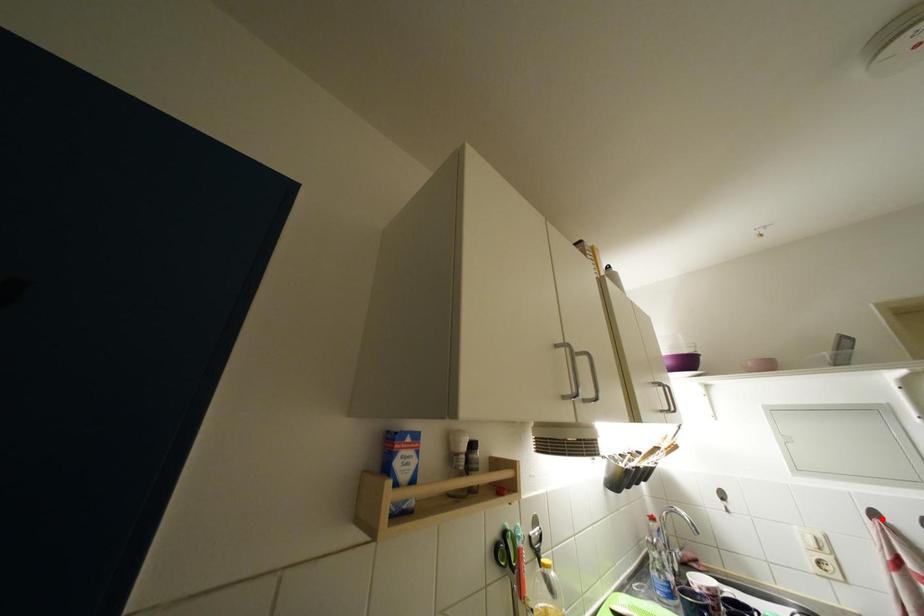
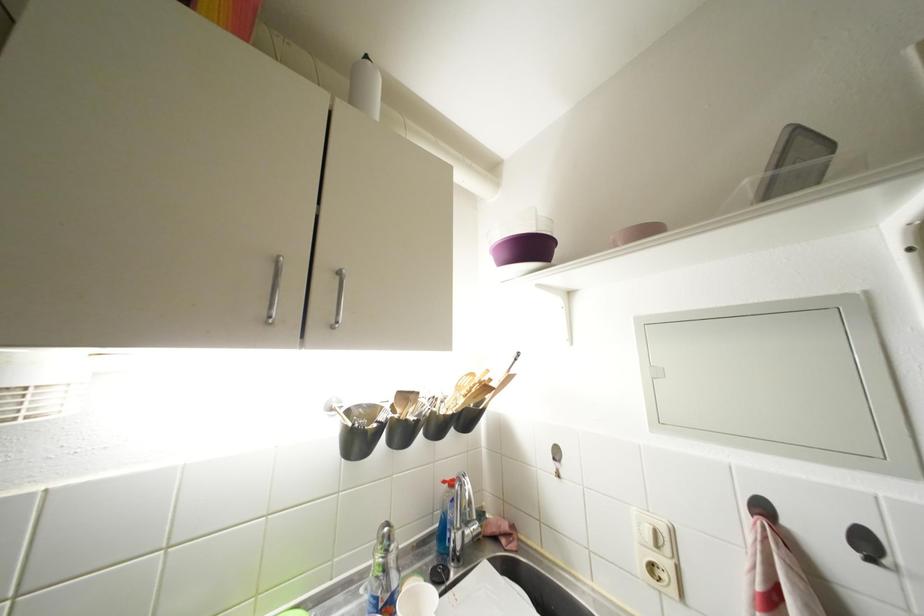
Question: I am providing you with two images of the same scene from different viewpoints. A red point is shown in image1. For the corresponding object point in image2, is it positioned nearer or farther from the camera?

Choices:
 (A) Nearer
 (B) Farther

Answer: (B)